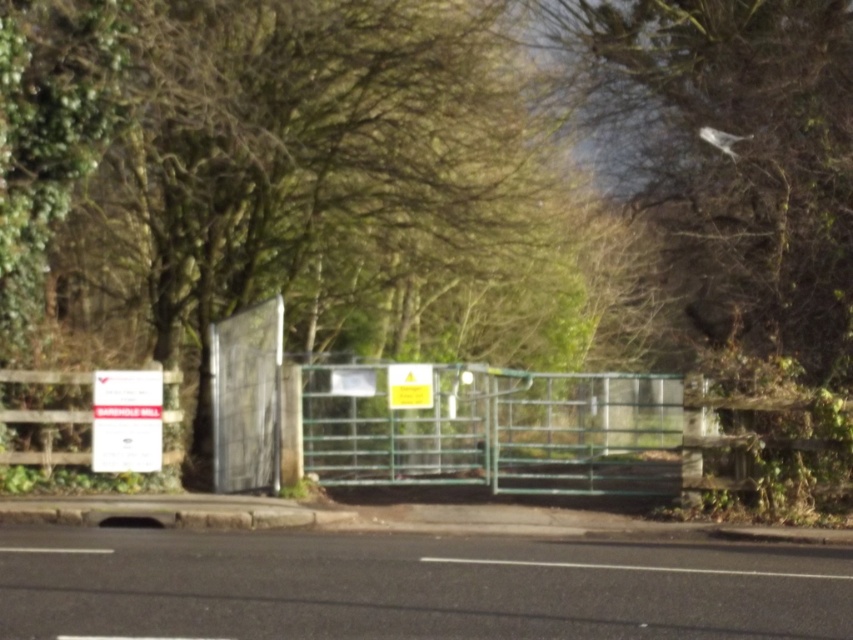
Question: Which point is farther to the camera?

Choices:
 (A) (55, 456)
 (B) (387, 372)
 (C) (665, 490)

Answer: (B)

Question: Is wooden fence at left below yellow paper sign at center?

Choices:
 (A) no
 (B) yes

Answer: (B)

Question: Which point is closer to the camera?

Choices:
 (A) (102, 438)
 (B) (410, 392)
 (C) (682, 401)

Answer: (C)

Question: Considering the relative positions of green metal gate at center and white paper sign at upper left in the image provided, where is green metal gate at center located with respect to white paper sign at upper left?

Choices:
 (A) below
 (B) above

Answer: (A)

Question: Among these points, which one is farthest from the camera?

Choices:
 (A) (151, 412)
 (B) (509, 422)

Answer: (B)

Question: Can you confirm if green metal gate at center is positioned to the right of wooden fence at left?

Choices:
 (A) yes
 (B) no

Answer: (A)